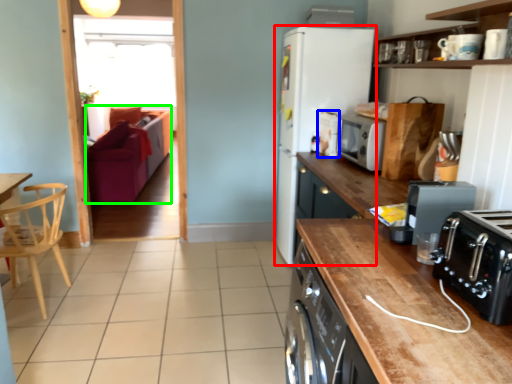
Question: Which is nearer to the refrigerator (highlighted by a red box)? appliance (highlighted by a blue box) or armchair (highlighted by a green box).

Choices:
 (A) appliance
 (B) armchair

Answer: (A)